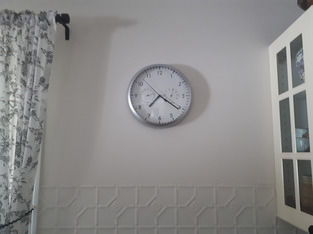
Where is `cabinet`? The height and width of the screenshot is (234, 313). cabinet is located at coordinates (277, 131).